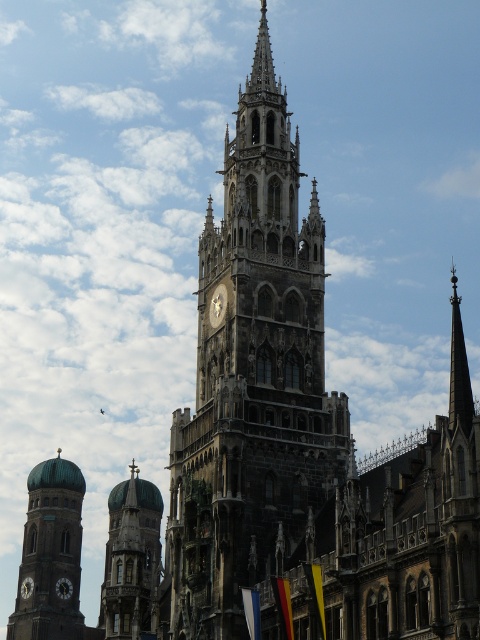
You are standing in front of the Gothic tower and want to take a photo of both the green glazed dome at center and the golden metallic clock at center. Which object should you position closer to the camera to ensure both are in focus?

You should position the green glazed dome at center closer to the camera since it is in front of the golden metallic clock at center. This way, both objects will be in focus as they are at different distances from the camera.

You are an architect planning to install a new light pole between the green glazed dome at center and the matte black clock at lower left. The light pole requires a minimum of 40 feet of space between the two objects to be safely installed. Can you confirm if there is enough space?

The green glazed dome at center is 50.17 feet from the matte black clock at lower left, which is more than the required 40 feet. Therefore, there is sufficient space to install the light pole safely between them.

You are an architect inspecting the tower. You notice the green glazed dome at center and the matte black clock at lower left. Which object would appear larger in your field of view?

The green glazed dome at center appears larger because it is closer to the viewer than the matte black clock at lower left.